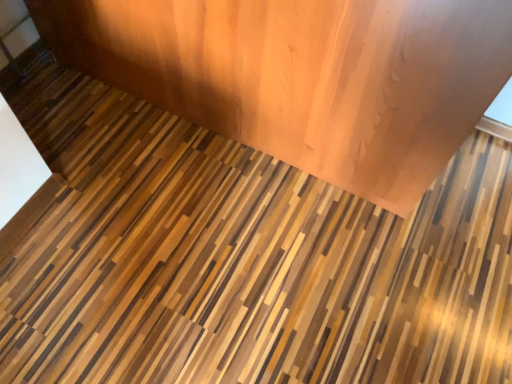
Measure the distance between point (188,10) and camera.

Point (188,10) and camera are 1.07 meters apart.

The width and height of the screenshot is (512, 384). What do you see at coordinates (305, 76) in the screenshot? I see `matte wood cabinet at upper center` at bounding box center [305, 76].

Where is `matte wood cabinet at upper center`? This screenshot has width=512, height=384. matte wood cabinet at upper center is located at coordinates (305, 76).

Identify the location of matte wood cabinet at upper center. (305, 76).